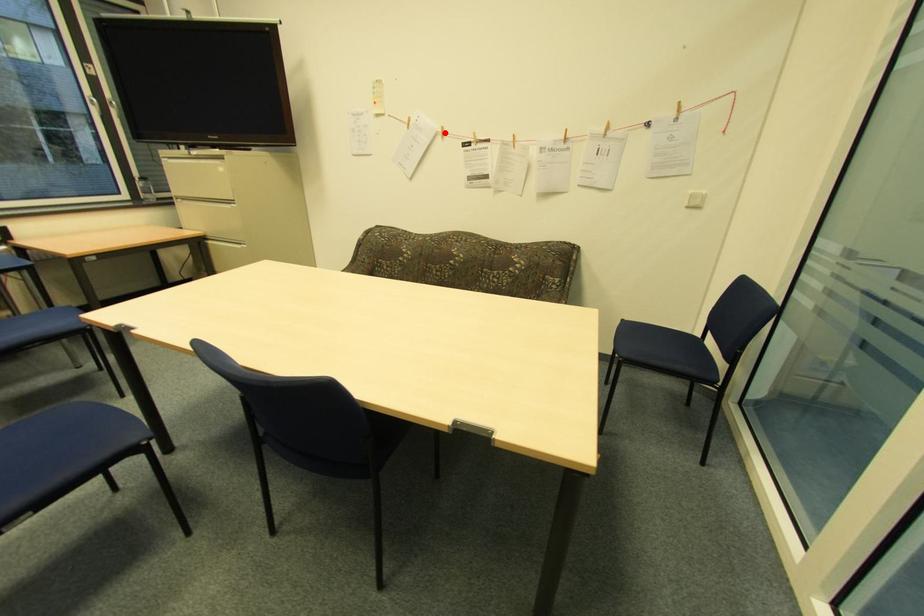
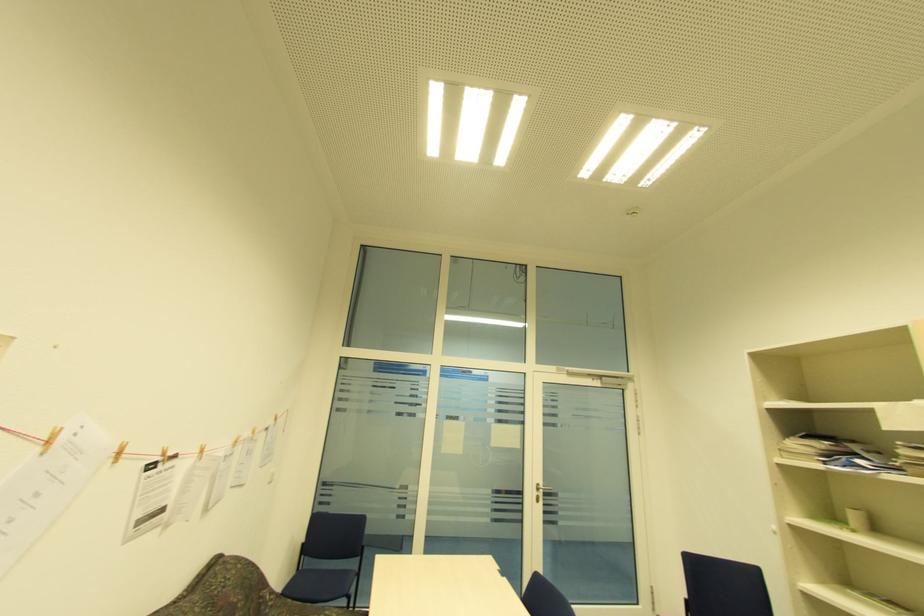
Find the pixel in the second image that matches the highlighted location in the first image.

(120, 454)